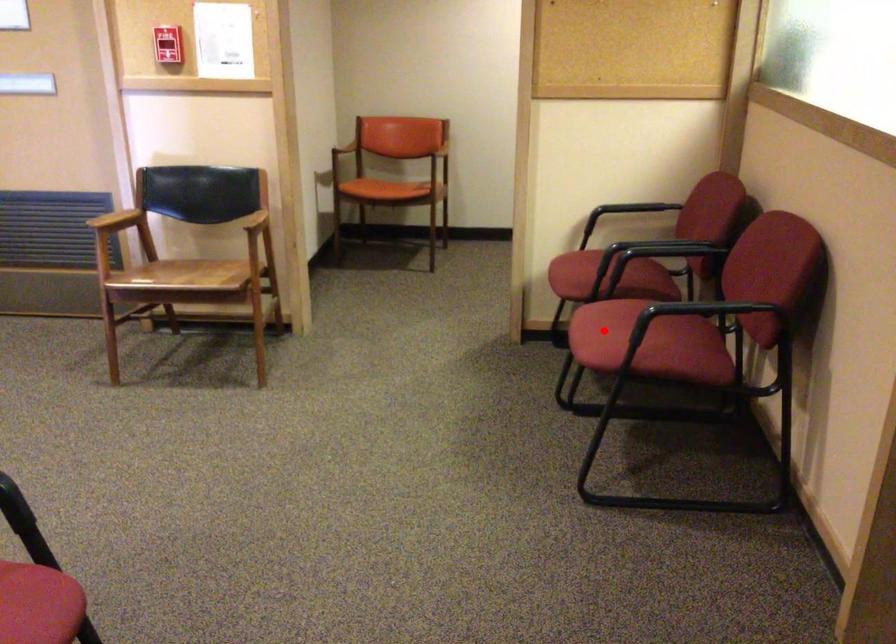
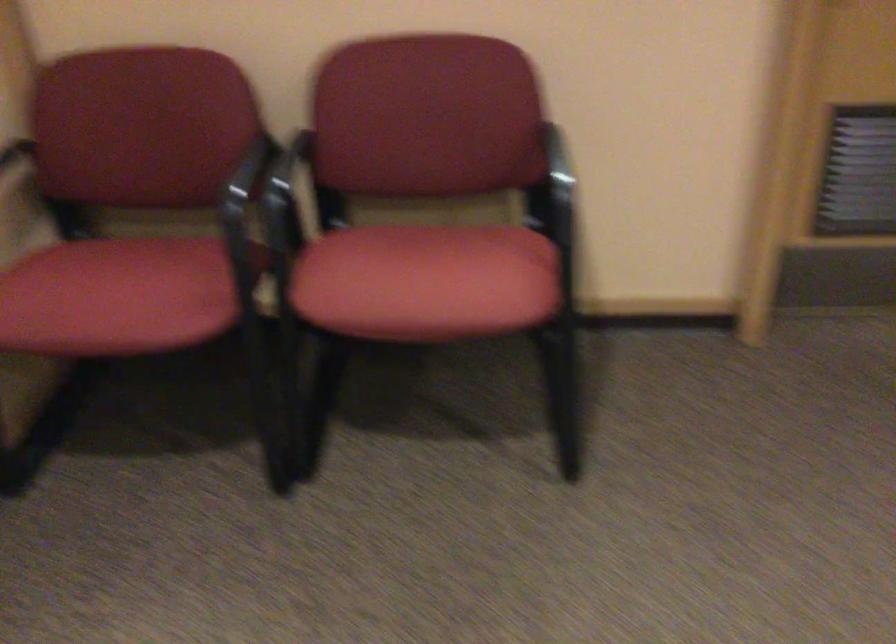
Where in the second image is the point corresponding to the highlighted location from the first image?

(426, 281)